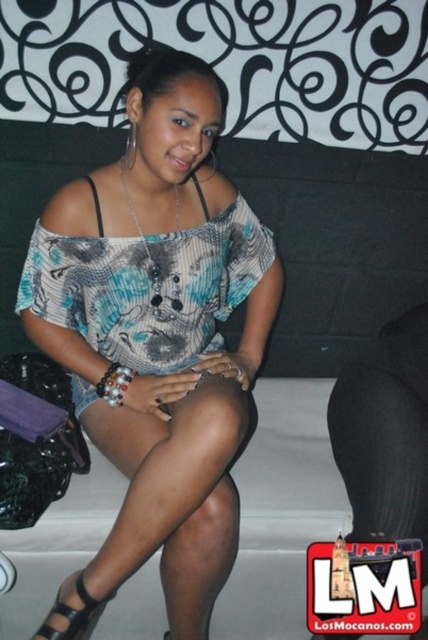
You are a fashion designer observing the scene. You need to determine the spatial relationship between the printed fabric blouse at center and the black leather sandal at lower left. Which one appears closer to you?

The printed fabric blouse at center is closer to the viewer than the black leather sandal at lower left.

You are a fashion designer who wants to place a new accessory between the printed fabric blouse at center and the printed fabric dress at center in the image. The accessory is 2 inches wide. Do you think there is enough space between them to fit the accessory?

The printed fabric blouse at center is 1.99 inches from printed fabric dress at center. Since the distance between them is just under 2 inches, the accessory may not fit comfortably. Consider moving one of the items slightly to create more space.

You are a fashion stylist trying to choose between two outfits for a client. The client has a narrow frame and wants to avoid looking too bulky. The options are the printed fabric blouse at center and the printed fabric dress at center. Based on their widths, which would be more flattering?

The printed fabric dress at center is more flattering because it has a narrower width than the printed fabric blouse at center, which is wider and might add bulk.